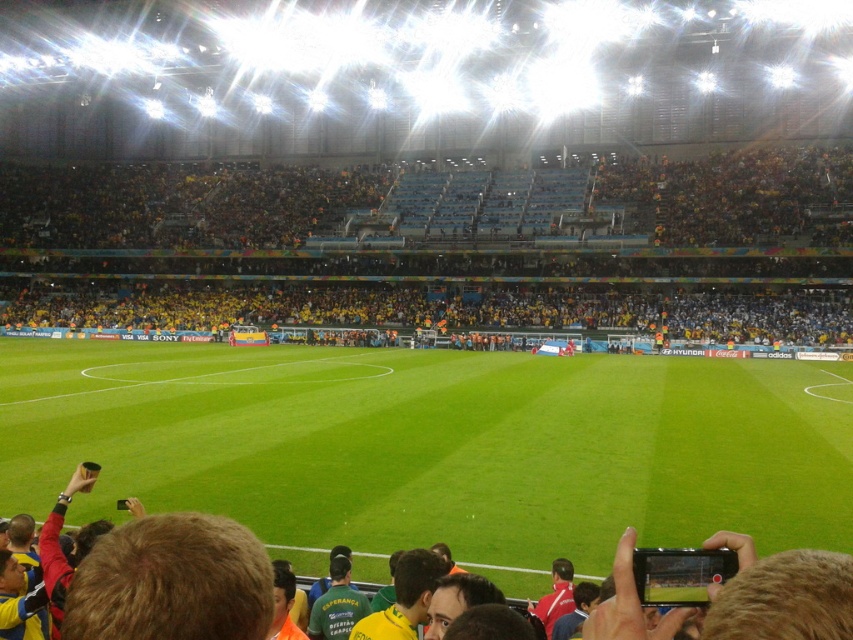
Question: Does green grass at center appear on the left side of yellow fabric seats at upper center?

Choices:
 (A) no
 (B) yes

Answer: (A)

Question: Which point is farther to the camera?

Choices:
 (A) (254, 298)
 (B) (558, 476)
 (C) (608, 612)

Answer: (A)

Question: Which point is farther to the camera?

Choices:
 (A) yellow fabric seats at upper center
 (B) green grass at center
 (C) brown leather jacket at lower center

Answer: (A)

Question: Among these points, which one is farthest from the camera?

Choices:
 (A) (653, 193)
 (B) (834, 474)

Answer: (A)

Question: From the image, what is the correct spatial relationship of green grass at center in relation to brown leather jacket at lower center?

Choices:
 (A) below
 (B) above

Answer: (A)

Question: Observing the image, what is the correct spatial positioning of yellow fabric seats at upper center in reference to brown leather jacket at lower center?

Choices:
 (A) left
 (B) right

Answer: (A)